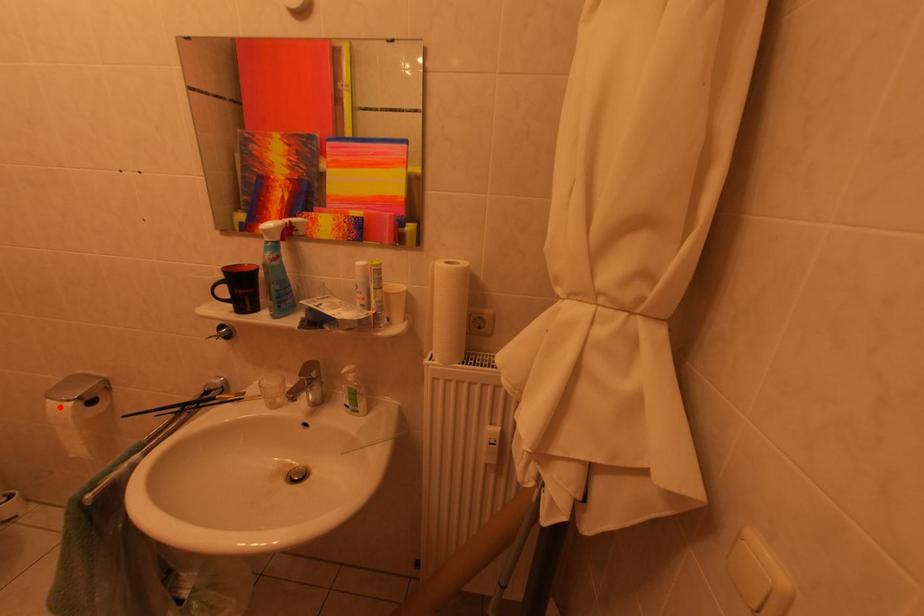
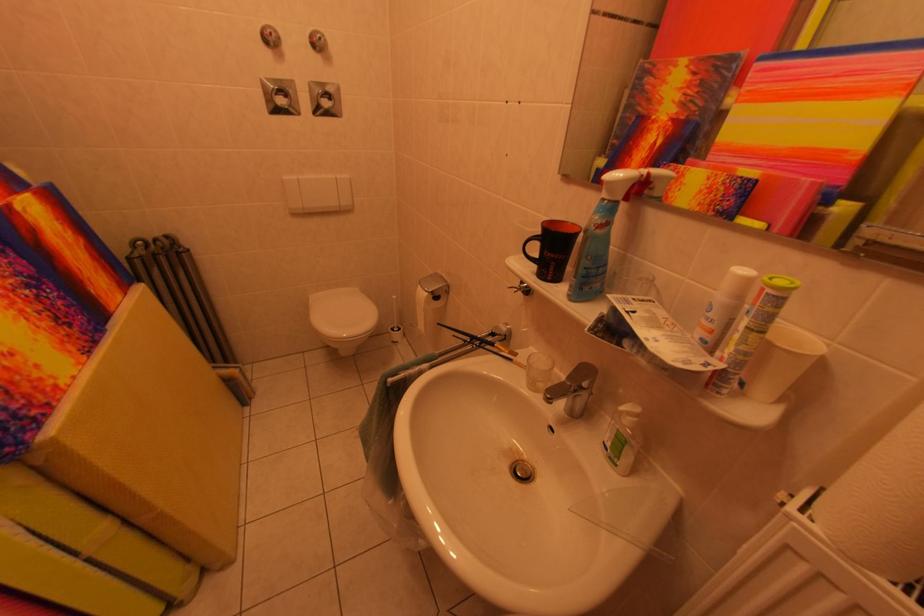
Locate, in the second image, the point that corresponds to the highlighted location in the first image.

(429, 292)